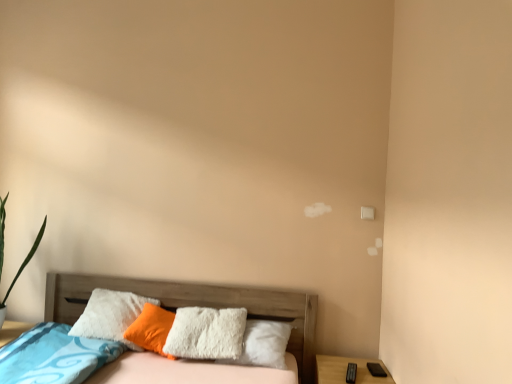
Where is `vacant space situated above wooden nightstand at lower right (from a real-world perspective)`? The width and height of the screenshot is (512, 384). vacant space situated above wooden nightstand at lower right (from a real-world perspective) is located at coordinates (355, 369).